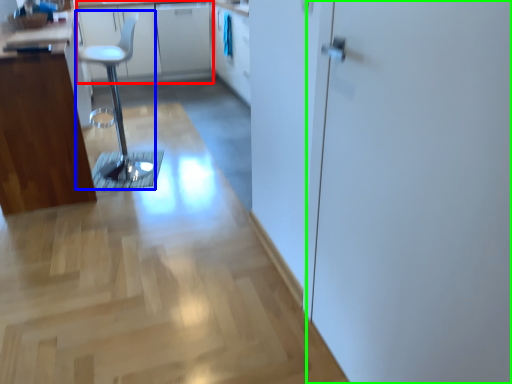
Question: Estimate the real-world distances between objects in this image. Which object is closer to counter top (highlighted by a red box), step stool (highlighted by a blue box) or screen door (highlighted by a green box)?

Choices:
 (A) step stool
 (B) screen door

Answer: (A)